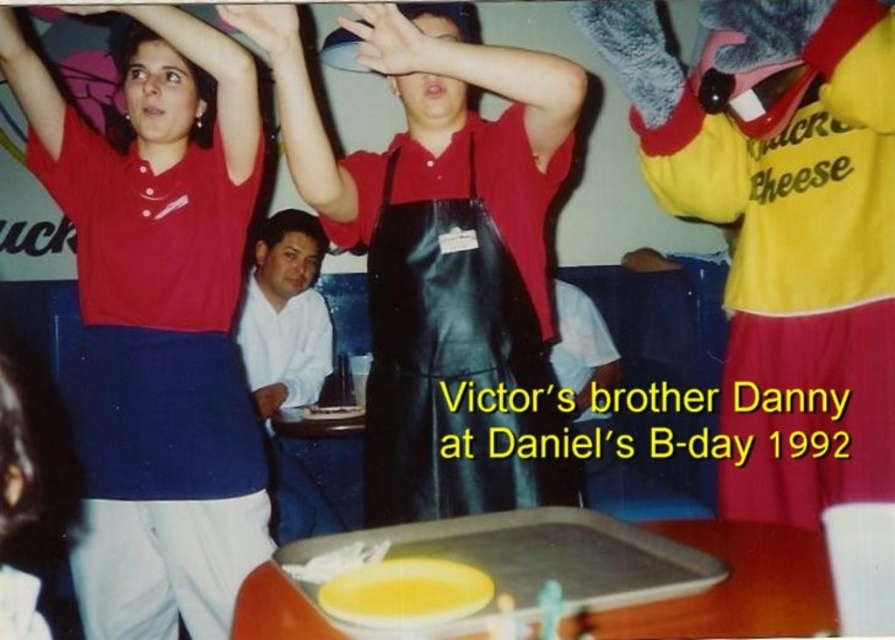
Question: Does matte red shirt at upper left have a larger size compared to matte black apron at center?

Choices:
 (A) yes
 (B) no

Answer: (A)

Question: Is matte red shirt at upper left to the left of matte black hand at upper center from the viewer's perspective?

Choices:
 (A) no
 (B) yes

Answer: (B)

Question: Which of the following is the closest to the observer?

Choices:
 (A) matte red shirt at upper left
 (B) matte skin hand at upper left
 (C) white cotton shirt at lower left

Answer: (B)

Question: Is matte black apron at center smaller than white cotton shirt at lower left?

Choices:
 (A) yes
 (B) no

Answer: (B)

Question: Which of the following is the closest to the observer?

Choices:
 (A) (382, 332)
 (B) (126, 225)

Answer: (A)

Question: Which point is farther to the camera?

Choices:
 (A) matte red shirt at upper left
 (B) matte black hand at upper center

Answer: (B)